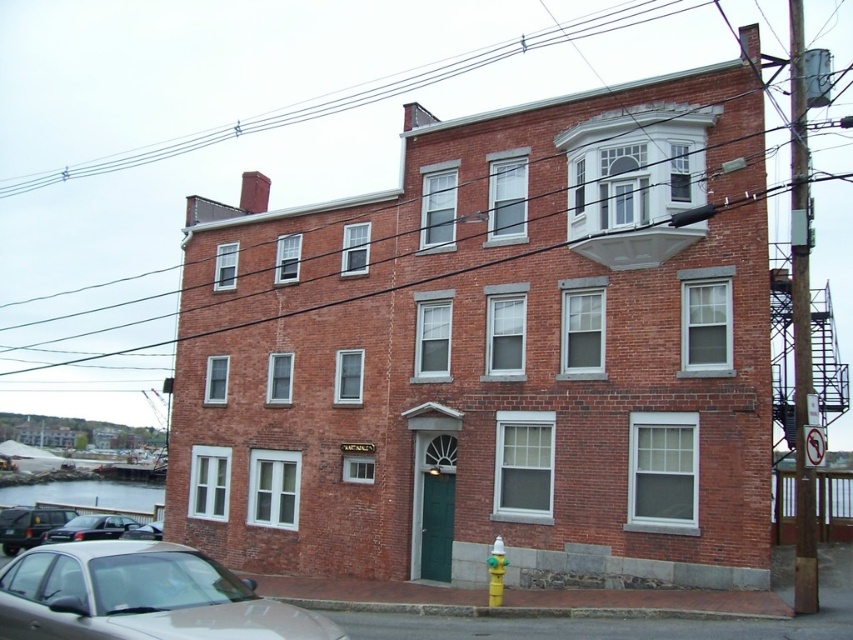
Question: Is shiny black car at lower left to the left of yellow matte hydrant at lower right from the viewer's perspective?

Choices:
 (A) no
 (B) yes

Answer: (B)

Question: Which object is the farthest from the yellow matte hydrant at lower right?

Choices:
 (A) silver metallic car at lower left
 (B) black glossy car at lower left

Answer: (B)

Question: Considering the real-world distances, which object is farthest from the yellow matte hydrant at lower right?

Choices:
 (A) shiny black car at lower left
 (B) silver metallic car at lower left

Answer: (A)

Question: Can you confirm if shiny black car at lower left is smaller than yellow matte hydrant at lower right?

Choices:
 (A) yes
 (B) no

Answer: (B)

Question: Based on their relative distances, which object is nearer to the black glossy car at lower left?

Choices:
 (A) shiny black car at lower left
 (B) silver metallic car at lower left
 (C) yellow matte hydrant at lower right

Answer: (A)

Question: Is shiny black car at lower left further to camera compared to black glossy car at lower left?

Choices:
 (A) no
 (B) yes

Answer: (B)